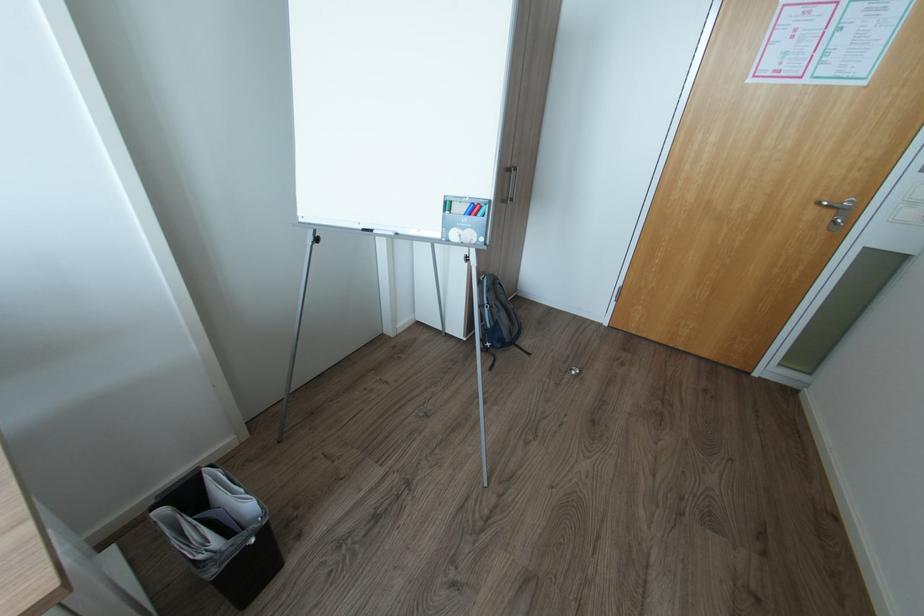
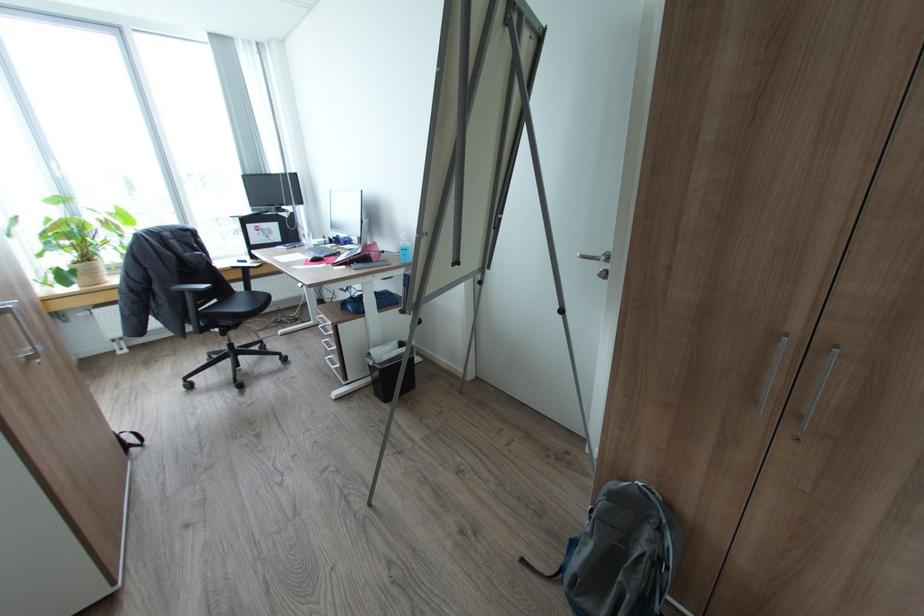
In the second image, find the point that corresponds to [257,541] in the first image.

(374, 363)